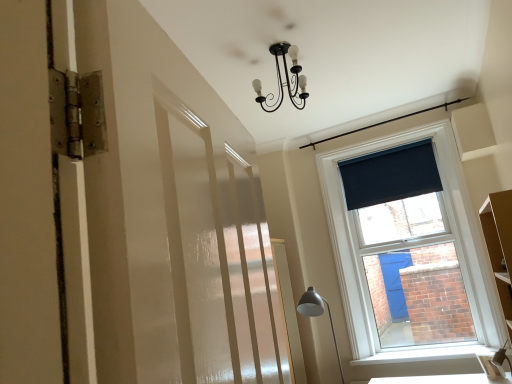
Question: From the image's perspective, is white smooth window sill at lower right under white glossy table at lower right?

Choices:
 (A) yes
 (B) no

Answer: (B)

Question: Is white smooth window sill at lower right positioned in front of white glossy table at lower right?

Choices:
 (A) yes
 (B) no

Answer: (B)

Question: Is white smooth window sill at lower right not near white glossy table at lower right?

Choices:
 (A) yes
 (B) no

Answer: (B)

Question: Is white smooth window sill at lower right oriented towards white glossy table at lower right?

Choices:
 (A) no
 (B) yes

Answer: (A)

Question: Is white smooth window sill at lower right completely or partially outside of white glossy table at lower right?

Choices:
 (A) yes
 (B) no

Answer: (A)

Question: Can you confirm if white smooth window sill at lower right is bigger than white glossy table at lower right?

Choices:
 (A) no
 (B) yes

Answer: (B)

Question: From a real-world perspective, is white smooth window sill at lower right over matte gray metal floor lamp at lower right?

Choices:
 (A) yes
 (B) no

Answer: (B)

Question: Is white smooth window sill at lower right not inside matte gray metal floor lamp at lower right?

Choices:
 (A) no
 (B) yes

Answer: (B)

Question: Does white smooth window sill at lower right have a lesser width compared to matte gray metal floor lamp at lower right?

Choices:
 (A) yes
 (B) no

Answer: (A)

Question: Is white smooth window sill at lower right in contact with matte gray metal floor lamp at lower right?

Choices:
 (A) yes
 (B) no

Answer: (B)

Question: Is white smooth window sill at lower right turned away from matte gray metal floor lamp at lower right?

Choices:
 (A) yes
 (B) no

Answer: (B)

Question: Does white smooth window sill at lower right have a larger size compared to matte gray metal floor lamp at lower right?

Choices:
 (A) no
 (B) yes

Answer: (A)

Question: Is the position of matte gray metal floor lamp at lower right less distant than that of dark blue fabric at upper right?

Choices:
 (A) yes
 (B) no

Answer: (A)